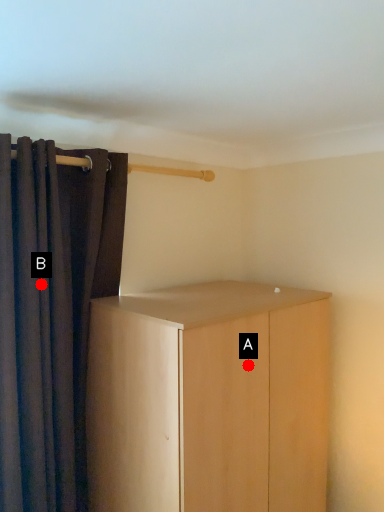
Question: Two points are circled on the image, labeled by A and B beside each circle. Which point is closer to the camera?

Choices:
 (A) A is closer
 (B) B is closer

Answer: (B)